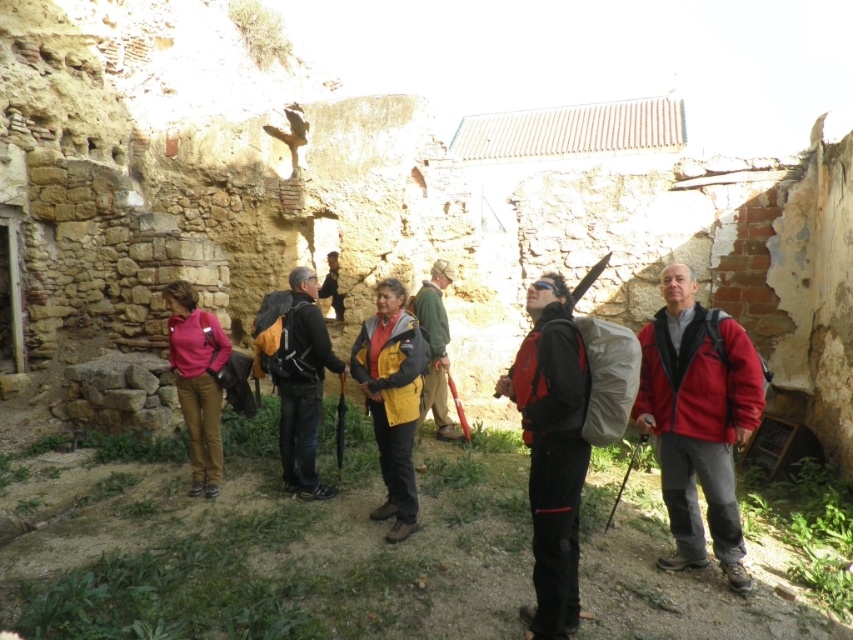
Question: Which is nearer to the matte black jacket at center?

Choices:
 (A) matte black backpack at center
 (B) red fleece jacket at center
 (C) green fabric jacket at center

Answer: (B)

Question: Can you confirm if red fleece jacket at center is positioned to the left of matte black backpack at center?

Choices:
 (A) yes
 (B) no

Answer: (B)

Question: Considering the real-world distances, which object is farthest from the green fabric jacket at center?

Choices:
 (A) matte black backpack at center
 (B) yellow matte jacket at center
 (C) matte black jacket at center
 (D) red fleece jacket at center

Answer: (D)

Question: Which of these objects is positioned farthest from the green fabric jacket at center?

Choices:
 (A) matte black jacket at center
 (B) yellow matte jacket at center
 (C) red fleece jacket at center
 (D) matte pink jacket at center-left

Answer: (C)

Question: Is red fleece jacket at center behind yellow matte jacket at center?

Choices:
 (A) yes
 (B) no

Answer: (B)

Question: Does red fleece jacket at center appear on the right side of green fabric jacket at center?

Choices:
 (A) no
 (B) yes

Answer: (B)